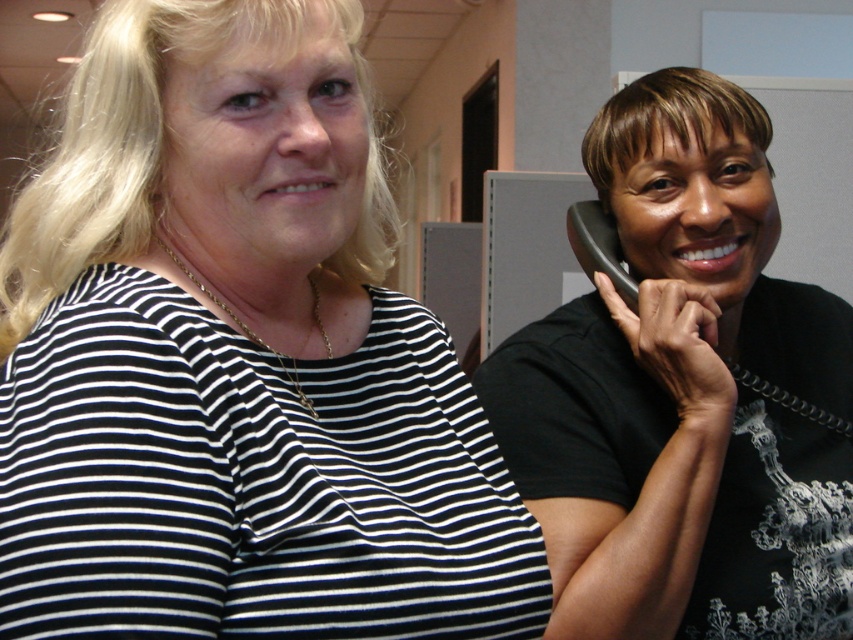
Who is shorter, black striped shirt at upper left or black rubber phone at right?

With less height is black rubber phone at right.

This screenshot has width=853, height=640. Describe the element at coordinates (236, 358) in the screenshot. I see `black striped shirt at upper left` at that location.

Does point (511, 627) come farther from viewer compared to point (595, 225)?

No, (511, 627) is closer to viewer.

Locate an element on the screen. black striped shirt at upper left is located at coordinates (236, 358).

Is black striped shirt at upper left below black matte phone at right?

No.

The width and height of the screenshot is (853, 640). What are the coordinates of `black striped shirt at upper left` in the screenshot? It's located at (236, 358).

The height and width of the screenshot is (640, 853). Find the location of `black striped shirt at upper left`. black striped shirt at upper left is located at coordinates (236, 358).

Does black matte phone at right appear under black rubber phone at right?

Yes, black matte phone at right is below black rubber phone at right.

Between point (543, 500) and point (624, 284), which one is positioned behind?

The point (624, 284) is more distant.

You are a GUI agent. You are given a task and a screenshot of the screen. Output one action in this format:
    pyautogui.click(x=<x>, y=<y>)
    Task: Click on the black matte phone at right
    The width and height of the screenshot is (853, 640).
    Given the screenshot: What is the action you would take?
    pyautogui.click(x=683, y=394)